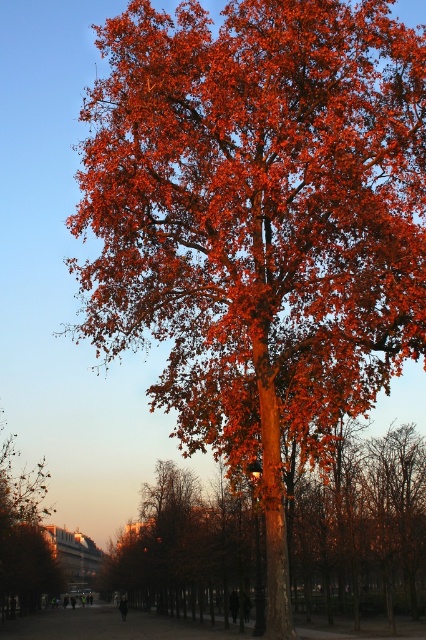
Question: Among these points, which one is nearest to the camera?

Choices:
 (A) (402, 544)
 (B) (39, 467)

Answer: (A)

Question: In this image, where is shiny orange leaves at center located relative to orange-brown bark tree at lower left?

Choices:
 (A) left
 (B) right

Answer: (B)

Question: Is shiny orange leaves at center closer to camera compared to orange-brown bark tree at lower left?

Choices:
 (A) yes
 (B) no

Answer: (A)

Question: Among these points, which one is farthest from the camera?

Choices:
 (A) (9, 445)
 (B) (339, 561)

Answer: (A)

Question: Can you confirm if shiny orange leaves at center is positioned above orange-brown bark tree at lower left?

Choices:
 (A) no
 (B) yes

Answer: (B)